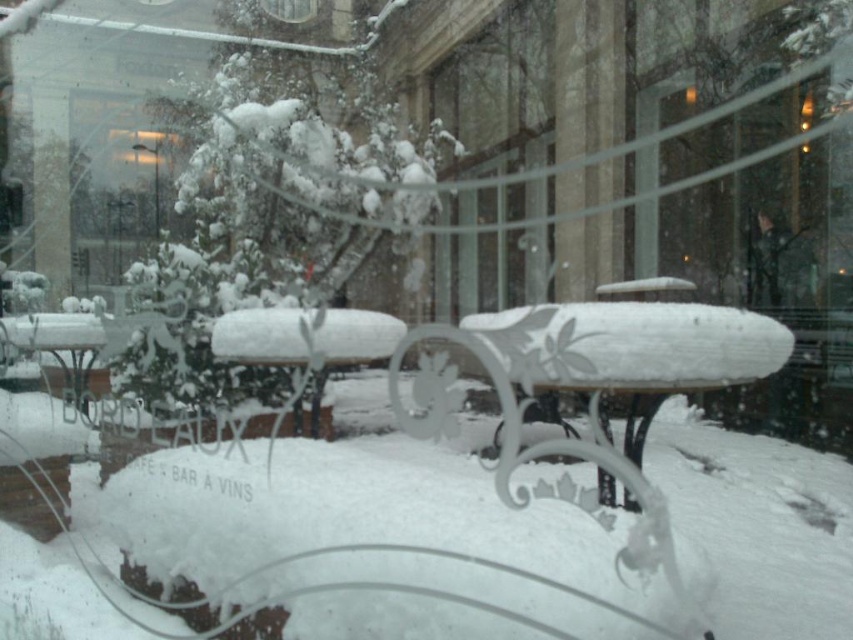
Can you confirm if white frosted glass table at center is wider than white frosted table at center?

Yes, white frosted glass table at center is wider than white frosted table at center.

Is white frosted glass table at center to the left of white frosted table at center from the viewer's perspective?

Incorrect, white frosted glass table at center is not on the left side of white frosted table at center.

Which is in front, point (647, 339) or point (312, 406)?

Point (647, 339)

This screenshot has width=853, height=640. In order to click on white frosted glass table at center in this screenshot , I will do [x=643, y=352].